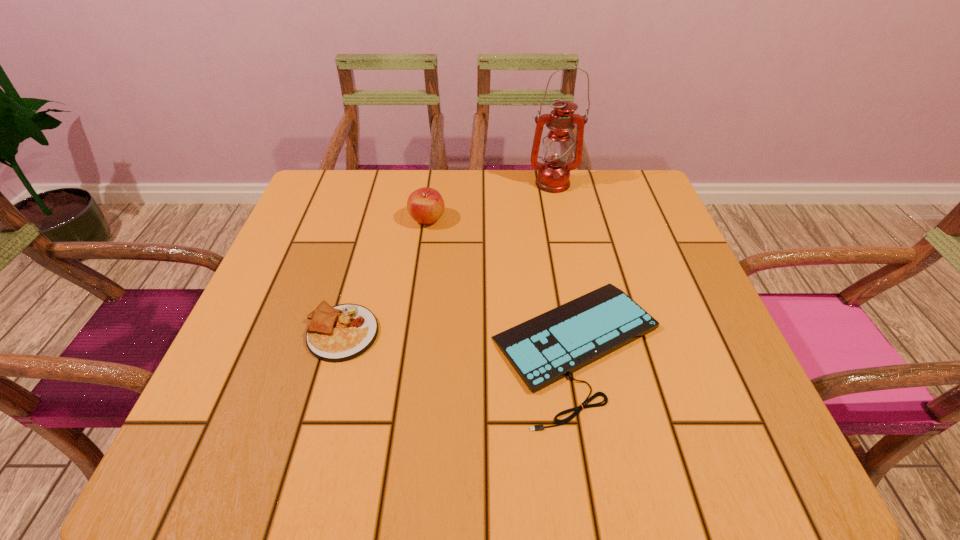
You are a GUI agent. You are given a task and a screenshot of the screen. Output one action in this format:
    pyautogui.click(x=<x>, y=<y>)
    Task: Click on the vacant space located on the left of the shortest object
    
    Given the screenshot: What is the action you would take?
    pyautogui.click(x=406, y=347)

I want to click on oil lamp present at the far edge, so click(x=553, y=176).

The width and height of the screenshot is (960, 540). I want to click on apple located in the far edge section of the desktop, so click(425, 205).

You are a GUI agent. You are given a task and a screenshot of the screen. Output one action in this format:
    pyautogui.click(x=<x>, y=<y>)
    Task: Click on the object that is positioned at the near edge
    The width and height of the screenshot is (960, 540).
    Given the screenshot: What is the action you would take?
    pyautogui.click(x=546, y=348)

You are a GUI agent. You are given a task and a screenshot of the screen. Output one action in this format:
    pyautogui.click(x=<x>, y=<y>)
    Task: Click on the object that is positioned at the left edge
    
    Given the screenshot: What is the action you would take?
    pyautogui.click(x=339, y=333)

Locate an element on the screen. Image resolution: width=960 pixels, height=540 pixels. object that is positioned at the right edge is located at coordinates (546, 348).

You are a GUI agent. You are given a task and a screenshot of the screen. Output one action in this format:
    pyautogui.click(x=<x>, y=<y>)
    Task: Click on the object present at the near right corner
    
    Given the screenshot: What is the action you would take?
    pyautogui.click(x=546, y=348)

Locate an element on the screen. Image resolution: width=960 pixels, height=540 pixels. free space at the far edge of the desktop is located at coordinates (487, 207).

I want to click on vacant space at the near edge of the desktop, so click(x=502, y=472).

You are a GUI agent. You are given a task and a screenshot of the screen. Output one action in this format:
    pyautogui.click(x=<x>, y=<y>)
    Task: Click on the vacant region at the left edge of the desktop
    This screenshot has width=960, height=540.
    Given the screenshot: What is the action you would take?
    coord(270,333)